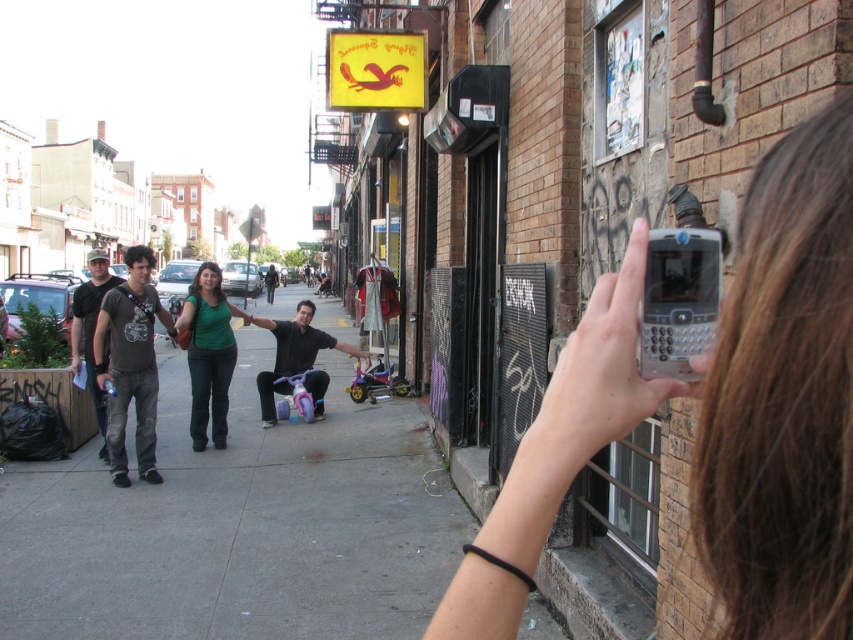
Between gray concrete sidewalk at center and matte black tricycle at center, which one appears on the left side from the viewer's perspective?

Positioned to the left is gray concrete sidewalk at center.

Is point (408, 429) positioned after point (279, 337)?

No.

At what (x,y) coordinates should I click in order to perform the action: click on gray concrete sidewalk at center. Please return your answer as a coordinate pair (x, y). This screenshot has height=640, width=853. Looking at the image, I should click on (238, 525).

I want to click on clear plastic phone at center, so click(x=601, y=371).

Which is more to the right, clear plastic phone at center or matte gray t-shirt at center?

clear plastic phone at center

Describe the element at coordinates (601, 371) in the screenshot. I see `clear plastic phone at center` at that location.

This screenshot has height=640, width=853. Identify the location of clear plastic phone at center. (601, 371).

Does green matte shirt at center appear on the left side of matte black tricycle at center?

Correct, you'll find green matte shirt at center to the left of matte black tricycle at center.

Between point (219, 349) and point (312, 305), which one is positioned behind?

Point (312, 305)

You are a GUI agent. You are given a task and a screenshot of the screen. Output one action in this format:
    pyautogui.click(x=<x>, y=<y>)
    Task: Click on the green matte shirt at center
    This screenshot has height=640, width=853.
    Given the screenshot: What is the action you would take?
    pyautogui.click(x=207, y=353)